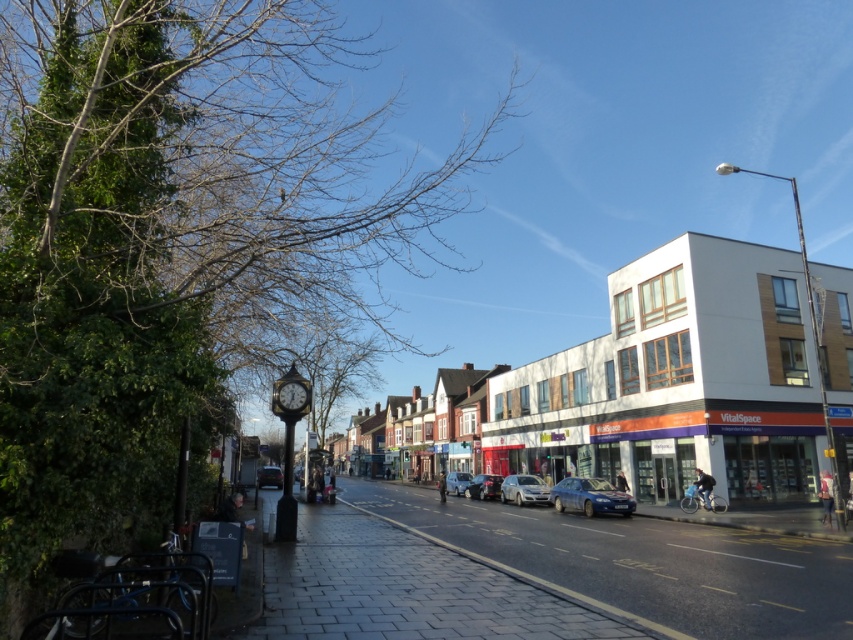
You are standing on the street looking at two points marked on the image. The first point is at coordinates point [558,500] and the second is at point [463,484]. Which point is closer to you?

Point [558,500] is in front of point [463,484], so it is closer to you.